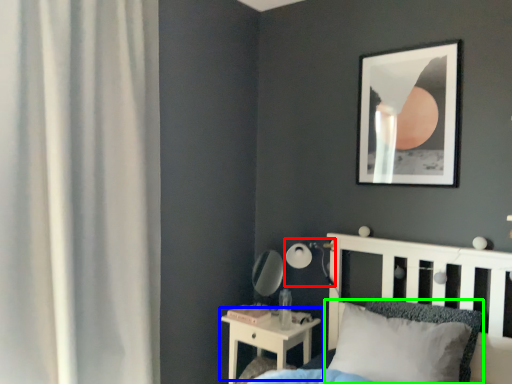
Question: Based on their relative distances, which object is farther from table lamp (highlighted by a red box)? Choose from nightstand (highlighted by a blue box) and pillow (highlighted by a green box).

Choices:
 (A) nightstand
 (B) pillow

Answer: (B)